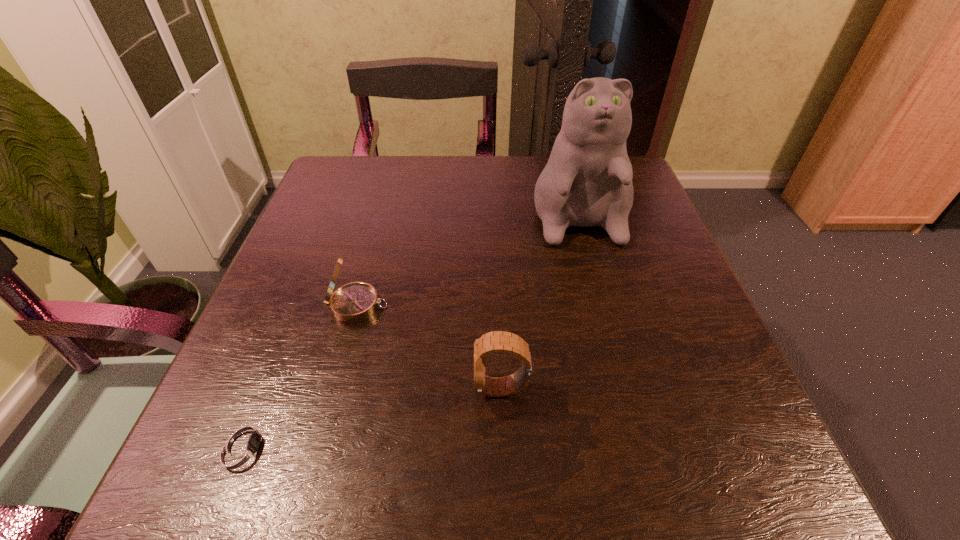
The width and height of the screenshot is (960, 540). Find the location of `vacant space that satisfies the following two spatial constraints: 1. on the face of the rightmost object; 2. with the dial facing the third nearest object`. vacant space that satisfies the following two spatial constraints: 1. on the face of the rightmost object; 2. with the dial facing the third nearest object is located at coordinates (603, 306).